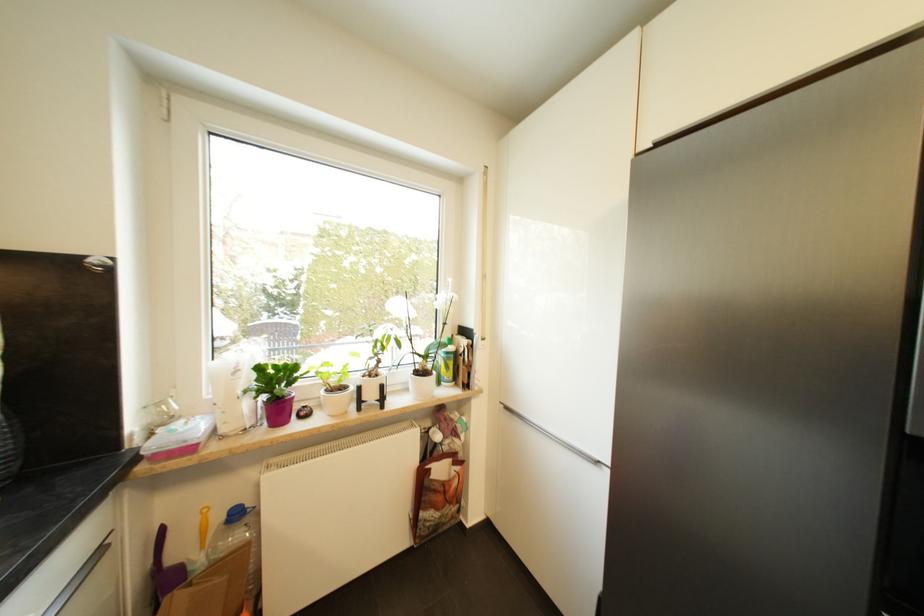
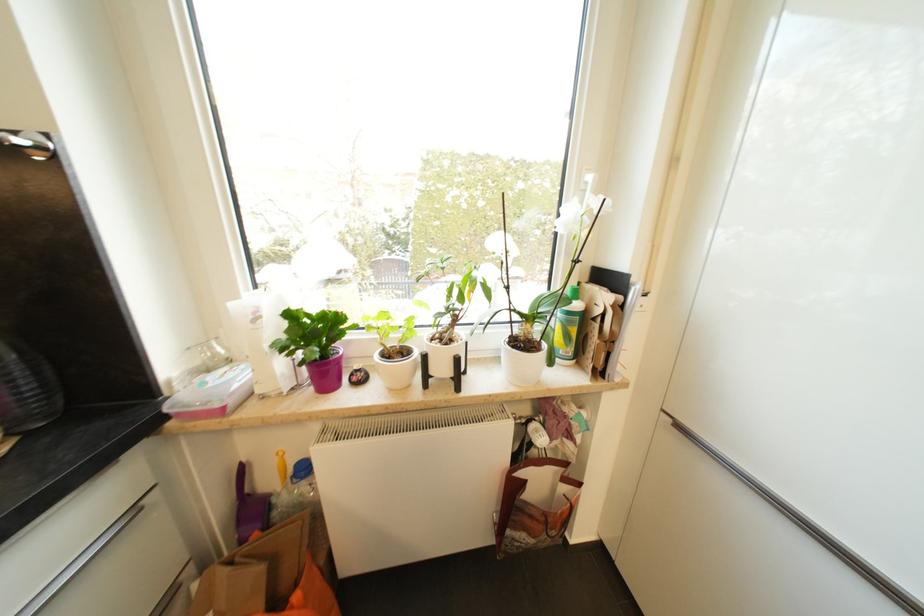
Where in the second image is the point corresponding to point 327,394 from the first image?

(381, 358)